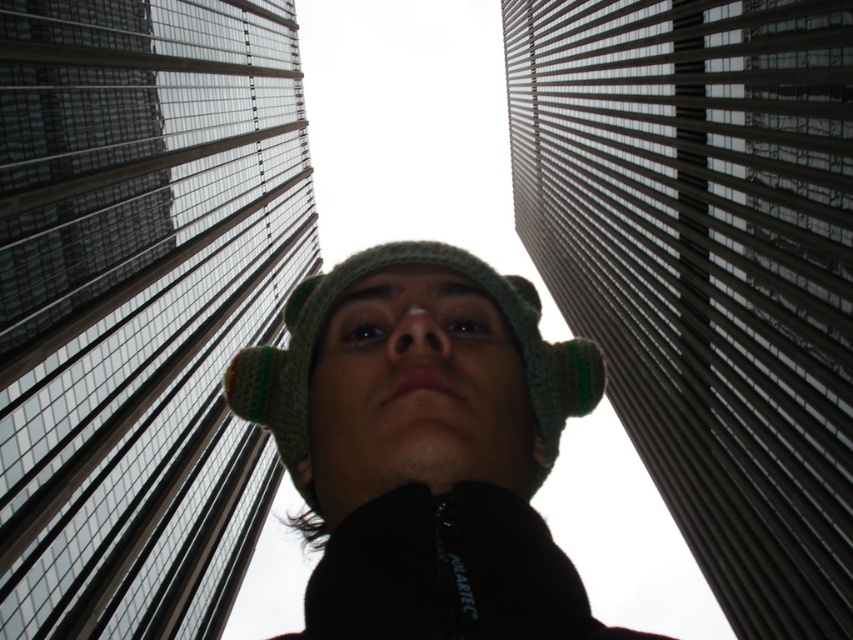
Question: Does glassy reflective skyscraper at center appear under green knitted hat at center?

Choices:
 (A) no
 (B) yes

Answer: (A)

Question: Is glassy steel skyscraper at center thinner than glassy reflective skyscraper at center?

Choices:
 (A) no
 (B) yes

Answer: (A)

Question: Is glassy steel skyscraper at center further to camera compared to glassy reflective skyscraper at center?

Choices:
 (A) no
 (B) yes

Answer: (A)

Question: Estimate the real-world distances between objects in this image. Which object is closer to the glassy reflective skyscraper at center?

Choices:
 (A) green knitted hat at center
 (B) glassy steel skyscraper at center

Answer: (B)

Question: Which point is farther from the camera taking this photo?

Choices:
 (A) (824, 381)
 (B) (103, 481)
 (C) (396, 252)

Answer: (B)

Question: Which object is closer to the camera taking this photo?

Choices:
 (A) glassy steel skyscraper at center
 (B) green knitted hat at center
 (C) glassy reflective skyscraper at center

Answer: (B)